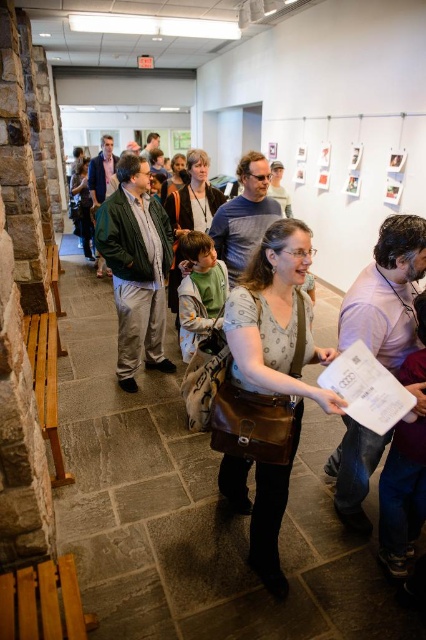
Is point (296, 244) closer to viewer compared to point (140, 340)?

That is True.

Between matte brown bag at center and green matte jacket at center, which one is positioned higher?

green matte jacket at center is higher up.

Does point (281, 257) come farther from viewer compared to point (109, 216)?

No, it is in front of (109, 216).

This screenshot has width=426, height=640. I want to click on matte brown bag at center, so point(271,380).